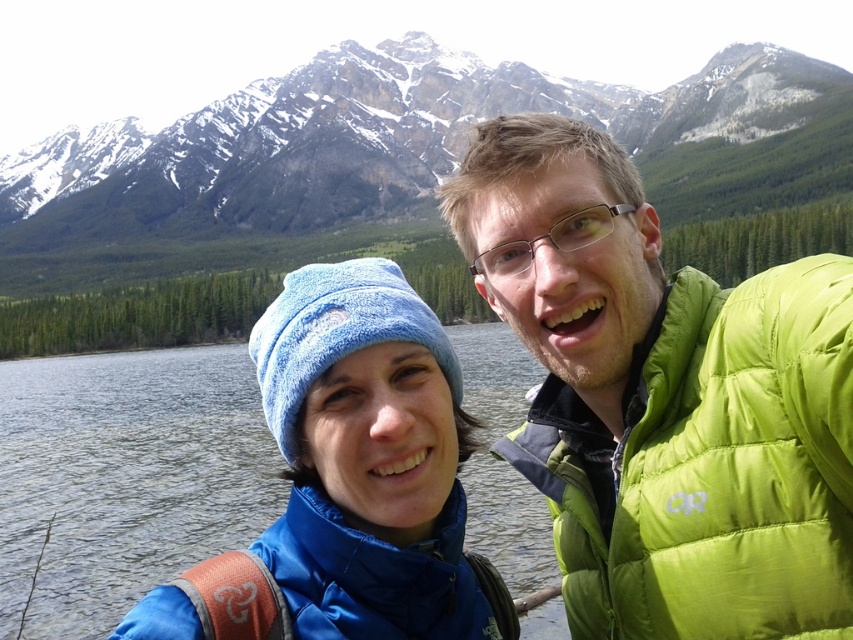
You are using a coordinate system where the bottom left corner of the image is the origin point. The coordinates are given as a pair of values between 0 and 1, where the first number represents the horizontal axis and the second number represents the vertical axis. Given this coordinate system, where is the lime green puffer jacket at upper right located?

The lime green puffer jacket at upper right is located at coordinates approximately 0.623 on the horizontal axis and 0.780 on the vertical axis.